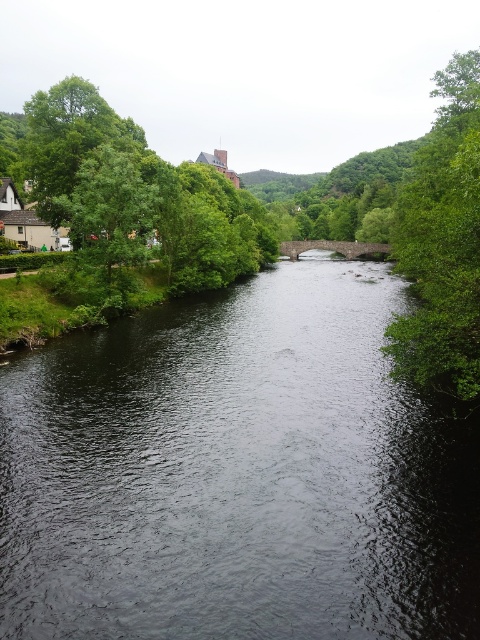
Consider the image. Can you confirm if dark gray water at center is positioned above green leafy tree at left?

No.

Between dark gray water at center and green leafy tree at left, which one is positioned higher?

Positioned higher is green leafy tree at left.

Who is more forward, (117, 417) or (156, 188)?

Point (117, 417) is more forward.

At what (x,y) coordinates should I click in order to perform the action: click on dark gray water at center. Please return your answer as a coordinate pair (x, y). The image size is (480, 640). Looking at the image, I should click on (237, 474).

Can you confirm if green leafy tree at upper left is smaller than green leafy tree at left?

Incorrect, green leafy tree at upper left is not smaller in size than green leafy tree at left.

Between green leafy tree at upper left and green leafy tree at left, which one appears on the right side from the viewer's perspective?

green leafy tree at upper left

Is point (43, 200) closer to camera compared to point (122, 172)?

No, it is behind (122, 172).

Find the location of a particular element. This screenshot has width=480, height=640. green leafy tree at upper left is located at coordinates (136, 193).

How distant is dark gray water at center from green leafy tree at right?

The distance of dark gray water at center from green leafy tree at right is 65.00 feet.

Does point (407, 518) lie in front of point (454, 97)?

Yes, it is in front of point (454, 97).

Which is behind, point (164, 403) or point (451, 208)?

Positioned behind is point (164, 403).

Find the location of a particular element. dark gray water at center is located at coordinates [x=237, y=474].